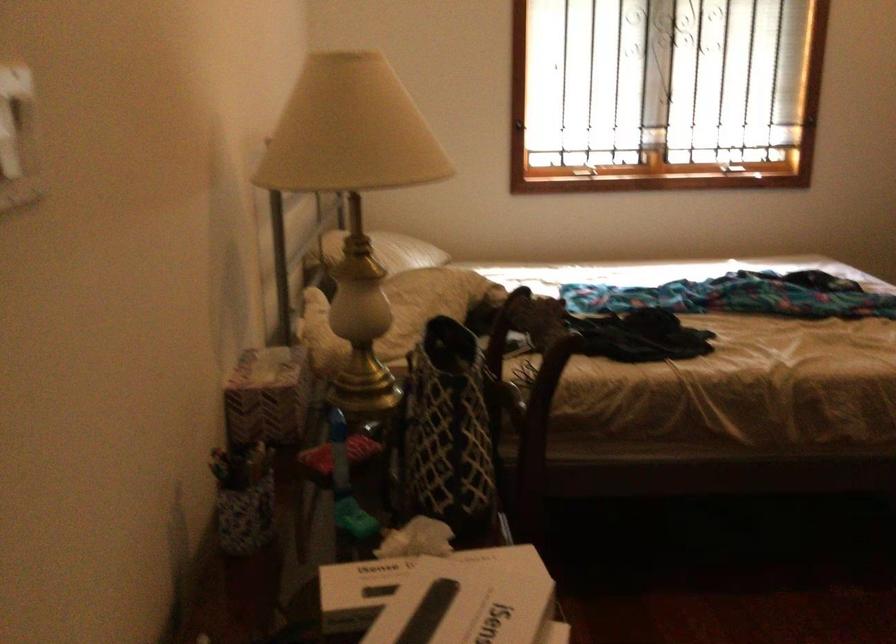
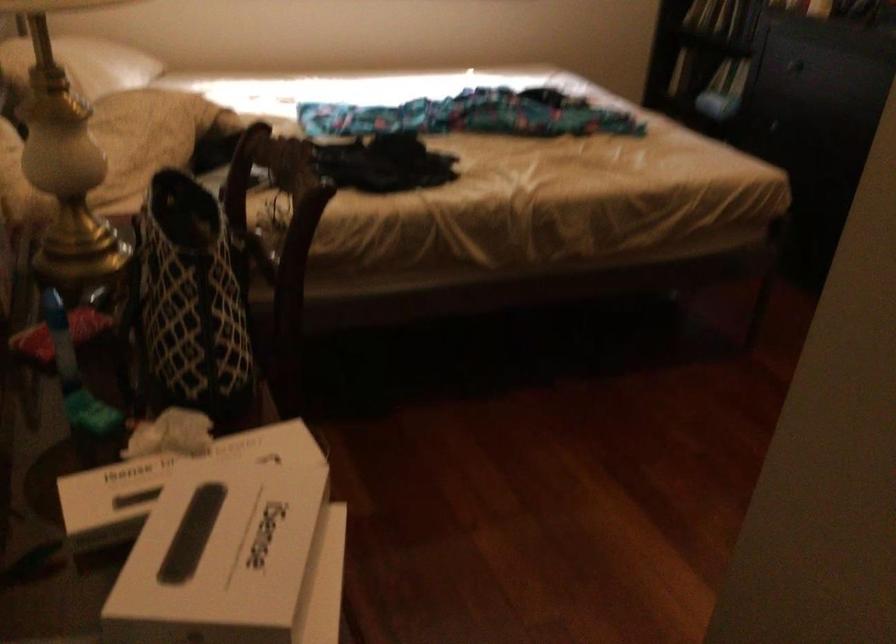
Question: The images are taken continuously from a first-person perspective. In which direction is your viewpoint rotating?

Choices:
 (A) Left
 (B) Right
 (C) Up
 (D) Down

Answer: (B)